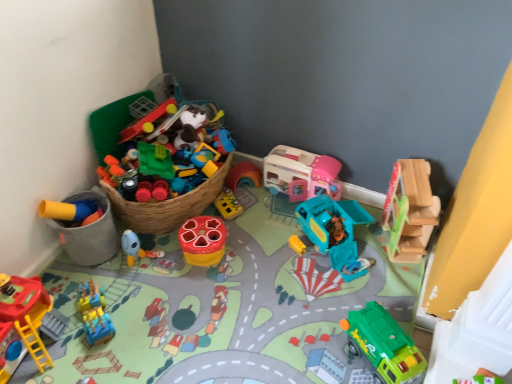
Find the location of a particular element. vacant area that lies in front of teal plastic truck at center, which ranks as the third toy in right-to-left order is located at coordinates (324, 290).